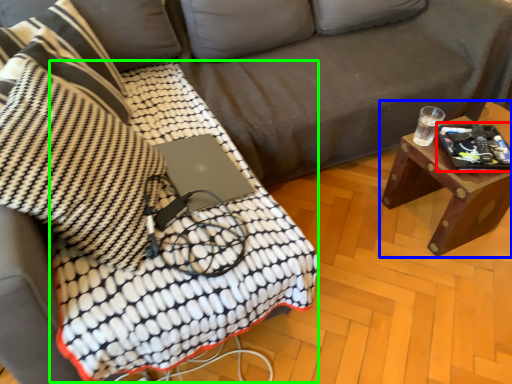
Question: Estimate the real-world distances between objects in this image. Which object is closer to tablet computer (highlighted by a red box), table (highlighted by a blue box) or blanket (highlighted by a green box)?

Choices:
 (A) table
 (B) blanket

Answer: (A)